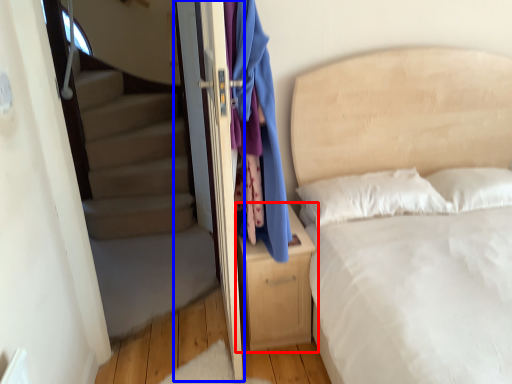
Question: Which object is further to the camera taking this photo, nightstand (highlighted by a red box) or screen door (highlighted by a blue box)?

Choices:
 (A) nightstand
 (B) screen door

Answer: (A)